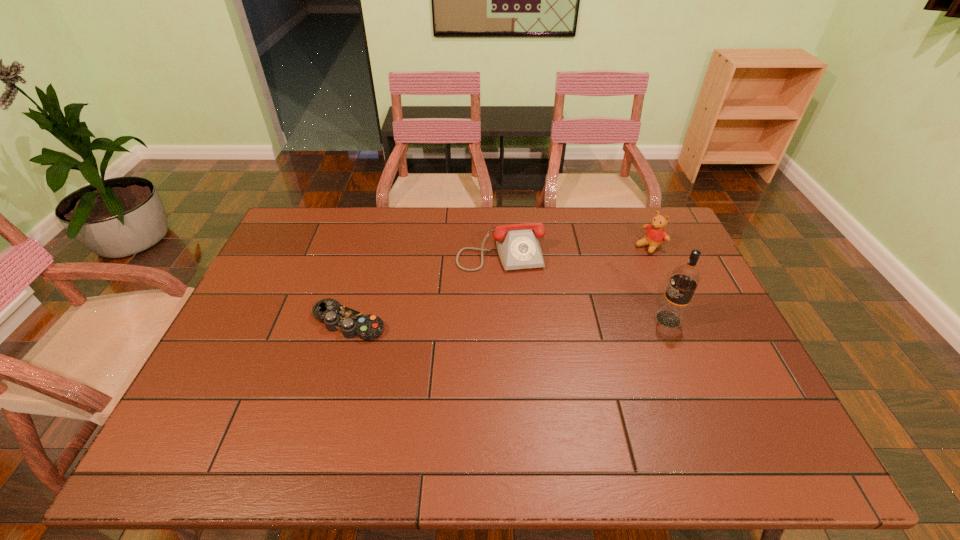
This screenshot has width=960, height=540. Identify the location of free space on the desktop that is between the control and the vodka and is positioned on the front-facing side of the third shortest object. (540, 320).

You are a GUI agent. You are given a task and a screenshot of the screen. Output one action in this format:
    pyautogui.click(x=<x>, y=<y>)
    Task: Click on the vacant space on the desktop that is between the leftmost object and the vodka and is positioned on the dial of the third object from right to left
    The height and width of the screenshot is (540, 960).
    Given the screenshot: What is the action you would take?
    pyautogui.click(x=518, y=321)